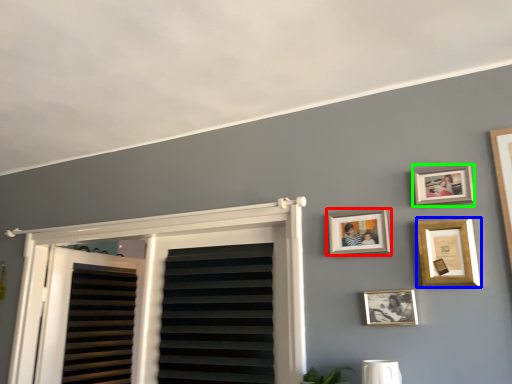
Question: Based on their relative distances, which object is farther from picture frame (highlighted by a red box)? Choose from picture frame (highlighted by a blue box) and picture frame (highlighted by a green box).

Choices:
 (A) picture frame
 (B) picture frame

Answer: (B)